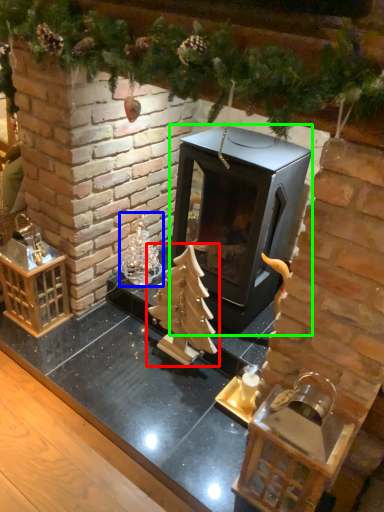
Question: Which is nearer to the christmas tree (highlighted by a red box)? christmas decoration (highlighted by a blue box) or fireplace (highlighted by a green box).

Choices:
 (A) christmas decoration
 (B) fireplace

Answer: (B)